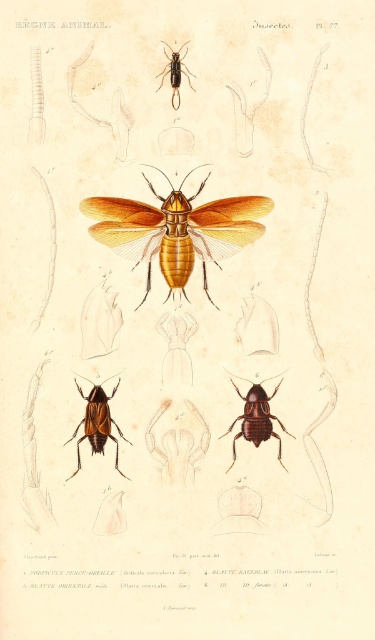
Which of these two, matte yellow winged insect at center or shiny brown beetle at center, stands shorter?

shiny brown beetle at center is shorter.

Does matte yellow winged insect at center have a greater width compared to shiny brown beetle at center?

Yes.

Describe the element at coordinates (177, 230) in the screenshot. I see `matte yellow winged insect at center` at that location.

Find the location of a particular element. The width and height of the screenshot is (375, 640). matte yellow winged insect at center is located at coordinates (177, 230).

In the scene shown: Can you confirm if matte yellow winged insect at center is bigger than shiny brown beetle at lower center?

Yes.

Based on the photo, who is lower down, matte yellow winged insect at center or shiny brown beetle at lower center?

shiny brown beetle at lower center

Is point (208, 230) closer to camera compared to point (238, 417)?

No.

This screenshot has height=640, width=375. I want to click on matte yellow winged insect at center, so pos(177,230).

Who is shorter, shiny brown beetle at center or shiny black beetle at upper center?

shiny black beetle at upper center

Who is lower down, shiny brown beetle at center or shiny black beetle at upper center?

shiny brown beetle at center is below.

This screenshot has height=640, width=375. I want to click on shiny brown beetle at center, so click(x=97, y=422).

Identify the location of shiny brown beetle at center. (97, 422).